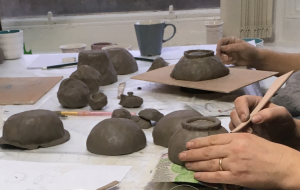
Where is `cups`? cups is located at coordinates (145, 28), (8, 41), (214, 26).